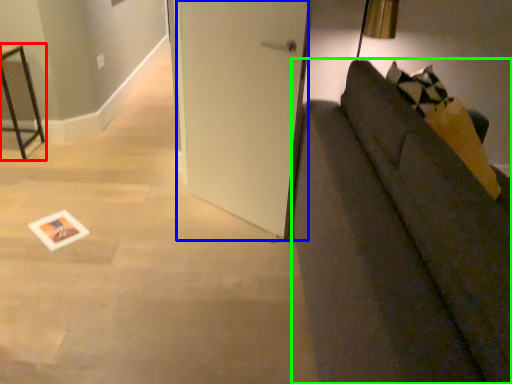
Question: Based on their relative distances, which object is farther from furniture (highlighted by a red box)? Choose from door (highlighted by a blue box) and studio couch (highlighted by a green box).

Choices:
 (A) door
 (B) studio couch

Answer: (B)